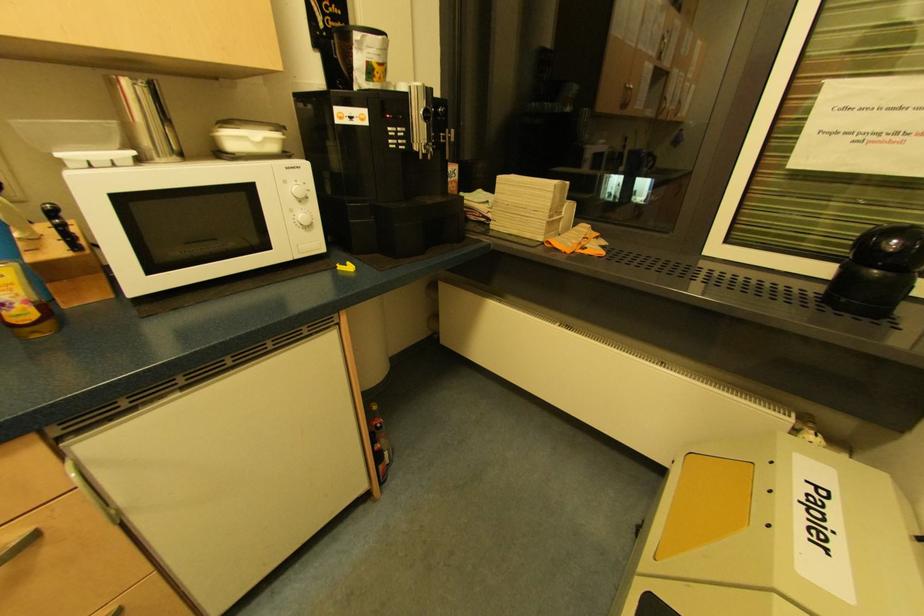
At what (x,y) coordinates should I click in order to perform the action: click on metal drawer handle. Please return your answer as a coordinate pair (x, y). Looking at the image, I should click on (19, 544).